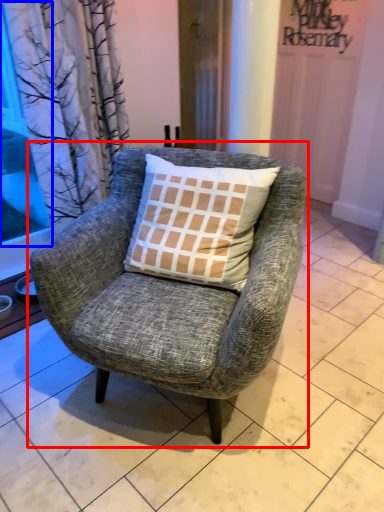
Question: Which object appears closest to the camera in this image, chair (highlighted by a red box) or window screen (highlighted by a blue box)?

Choices:
 (A) chair
 (B) window screen

Answer: (A)